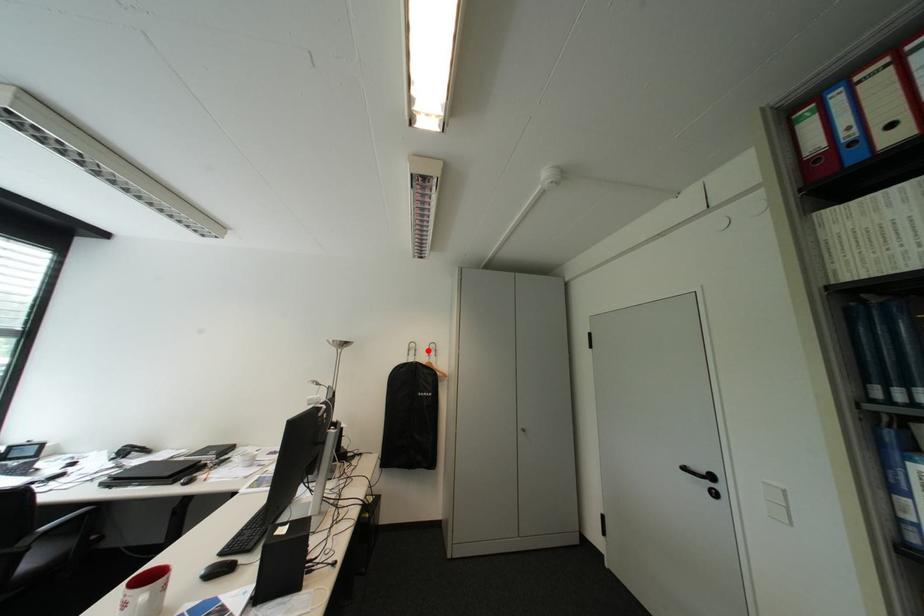
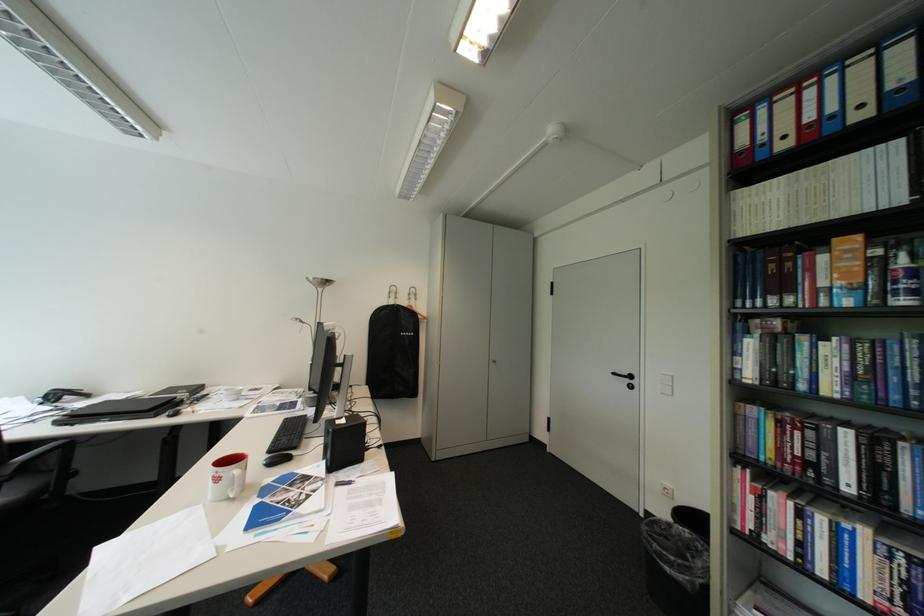
Find the pixel in the second image that matches the highlighted location in the first image.

(408, 294)